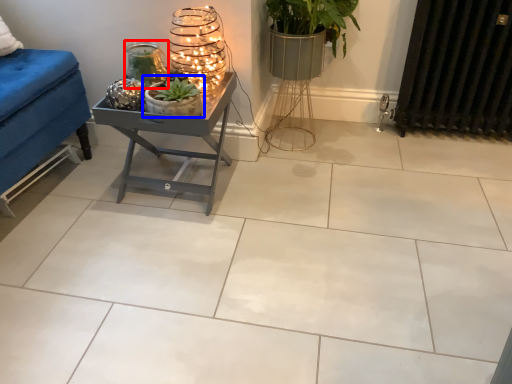
Question: Which of the following is the closest to the observer, candle holder (highlighted by a red box) or houseplant (highlighted by a blue box)?

Choices:
 (A) candle holder
 (B) houseplant

Answer: (B)